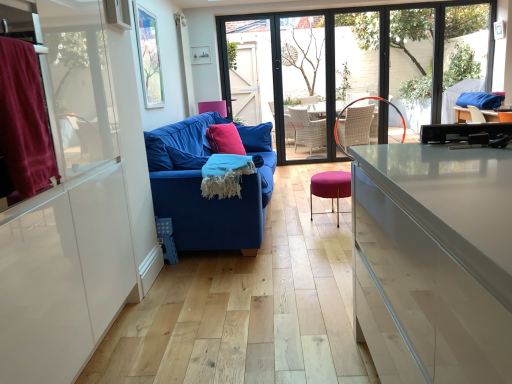
Question: From the image's perspective, is transparent glass window at center located above blue fabric couch at center?

Choices:
 (A) no
 (B) yes

Answer: (B)

Question: Is blue fabric couch at center located within transparent glass window at center?

Choices:
 (A) yes
 (B) no

Answer: (B)

Question: Does transparent glass window at center have a greater height compared to blue fabric couch at center?

Choices:
 (A) no
 (B) yes

Answer: (B)

Question: Is transparent glass window at center to the left of blue fabric couch at center from the viewer's perspective?

Choices:
 (A) yes
 (B) no

Answer: (B)

Question: Is transparent glass window at center oriented away from blue fabric couch at center?

Choices:
 (A) yes
 (B) no

Answer: (B)

Question: In terms of height, does velvet burgundy curtain at left, marked as the second window screen in a back-to-front arrangement, look taller or shorter compared to transparent glass window at center?

Choices:
 (A) short
 (B) tall

Answer: (A)

Question: Choose the correct answer: Is velvet burgundy curtain at left, marked as the second window screen in a back-to-front arrangement, inside transparent glass window at center or outside it?

Choices:
 (A) outside
 (B) inside

Answer: (A)

Question: Considering the positions of velvet burgundy curtain at left, marked as the second window screen in a back-to-front arrangement, and transparent glass window at center in the image, is velvet burgundy curtain at left, marked as the second window screen in a back-to-front arrangement, wider or thinner than transparent glass window at center?

Choices:
 (A) wide
 (B) thin

Answer: (A)

Question: Looking at the image, does velvet burgundy curtain at left, positioned as the second window screen in top-to-bottom order, seem bigger or smaller compared to transparent glass window at center?

Choices:
 (A) big
 (B) small

Answer: (B)

Question: In terms of height, does pink fabric pillow at center look taller or shorter compared to transparent glass window screen at upper center, placed as the 1th window screen when sorted from top to bottom?

Choices:
 (A) tall
 (B) short

Answer: (B)

Question: From the image's perspective, is pink fabric pillow at center above or below transparent glass window screen at upper center, which is counted as the 2th window screen, starting from the front?

Choices:
 (A) above
 (B) below

Answer: (B)

Question: Does point (222, 129) appear closer or farther from the camera than point (155, 16)?

Choices:
 (A) farther
 (B) closer

Answer: (A)

Question: Is pink fabric pillow at center bigger or smaller than transparent glass window screen at upper center, the second window screen when ordered from bottom to top?

Choices:
 (A) small
 (B) big

Answer: (B)

Question: From a real-world perspective, is velvet burgundy curtain at left positioned above or below transparent glass window screen at upper center, placed as the 1th window screen when sorted from top to bottom?

Choices:
 (A) below
 (B) above

Answer: (A)

Question: Looking at their shapes, would you say velvet burgundy curtain at left is wider or thinner than transparent glass window screen at upper center, placed as the 1th window screen when sorted from top to bottom?

Choices:
 (A) thin
 (B) wide

Answer: (B)